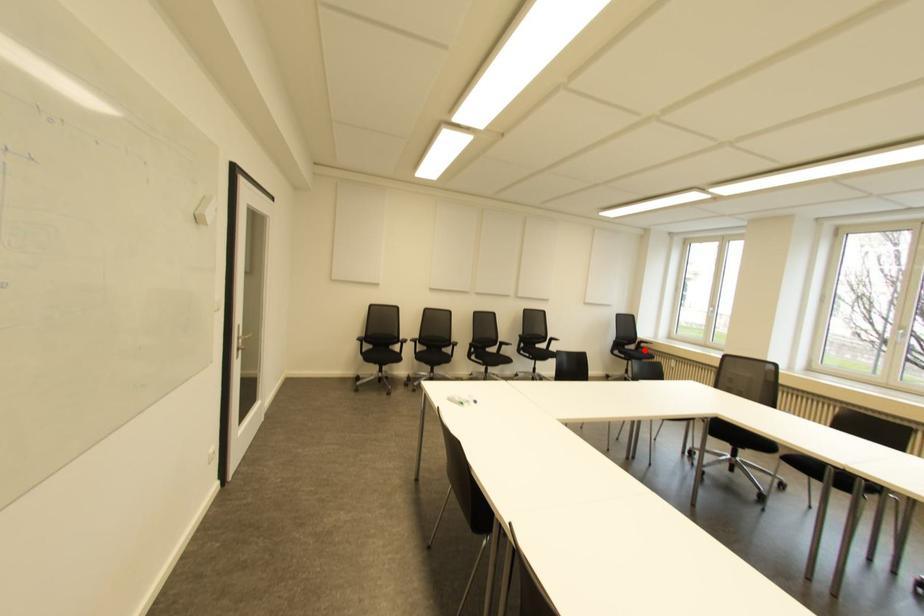
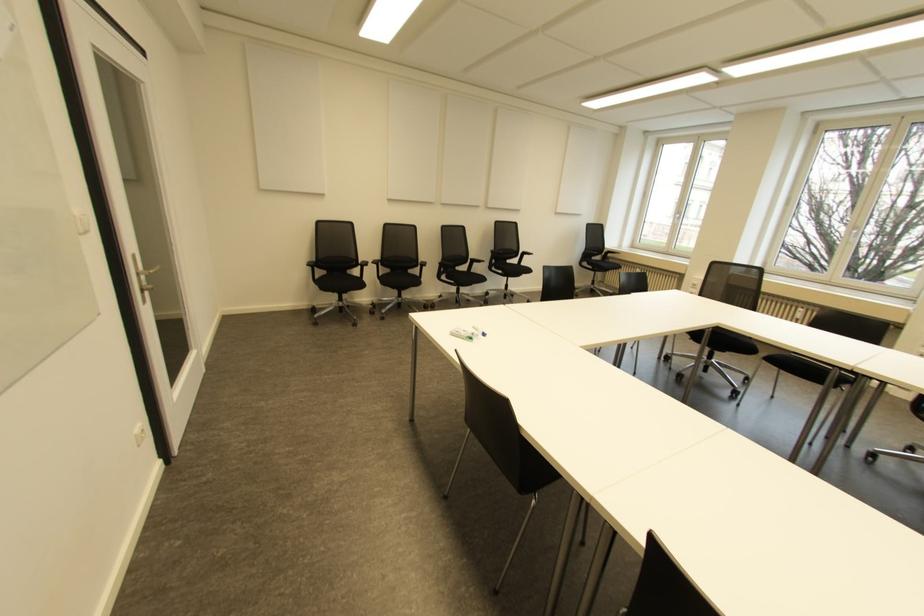
In the second image, find the point that corresponds to the highlighted location in the first image.

(610, 261)